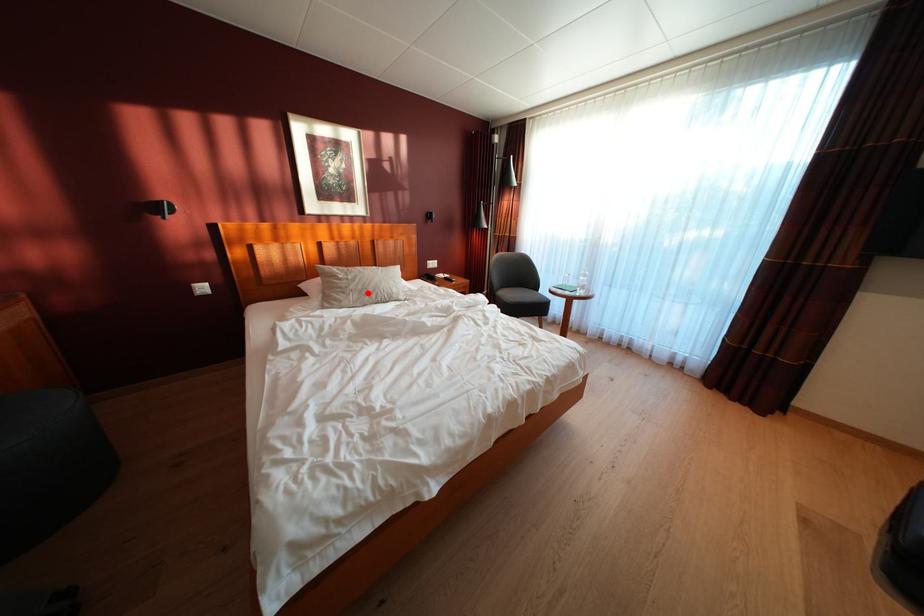
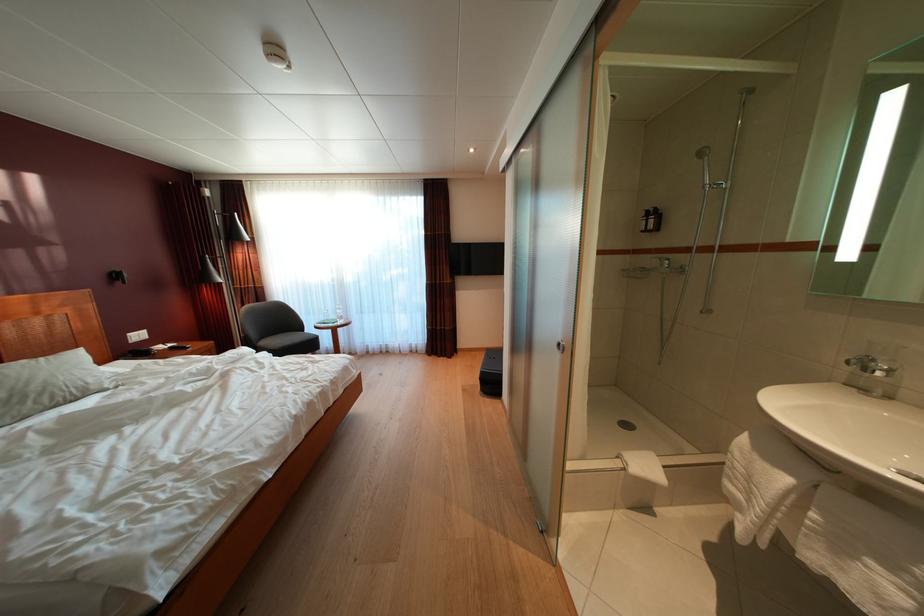
In the second image, find the point that corresponds to the highlighted location in the first image.

(10, 400)